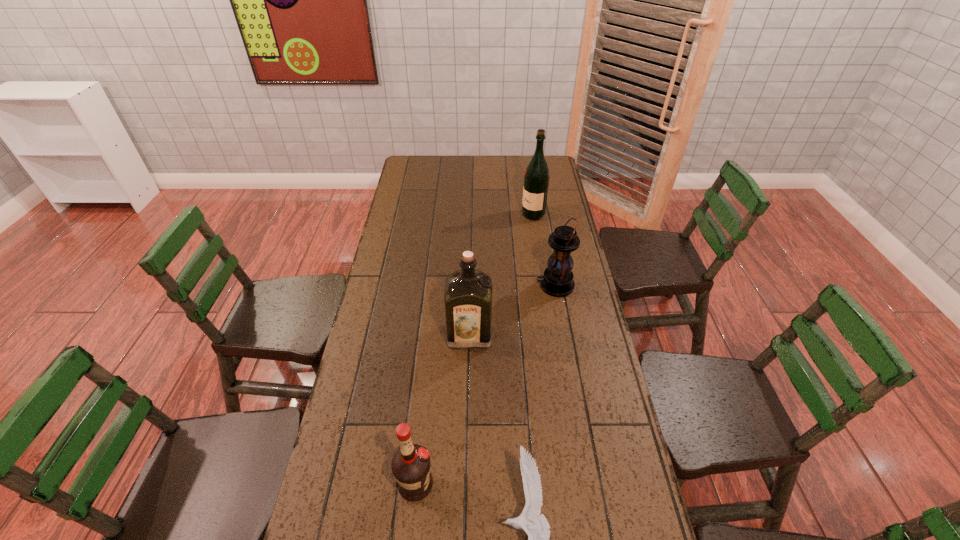
This screenshot has height=540, width=960. I want to click on free point at the far left corner, so click(412, 167).

What are the coordinates of `free space between the fourth object from right to left and the shortest liquor` in the screenshot? It's located at (443, 410).

Identify the location of vacant area between the nearest liquor and the second farthest object. Image resolution: width=960 pixels, height=540 pixels. (486, 385).

Identify the location of free point between the lantern and the shortest liquor. (486, 385).

This screenshot has width=960, height=540. Identify the location of unoccupied area between the lantern and the farthest object. (544, 250).

I want to click on free space between the second liquor from left to right and the rightmost liquor, so click(501, 275).

Identify the location of free spot between the second liquor from right to left and the second farthest object. The height and width of the screenshot is (540, 960). (513, 310).

This screenshot has width=960, height=540. In order to click on the third closest object to the farthest object in this screenshot , I will do `click(535, 524)`.

Where is `object that is the nearest to the fourth nearest object`? object that is the nearest to the fourth nearest object is located at coordinates (468, 292).

The height and width of the screenshot is (540, 960). I want to click on liquor that is the closest to the fourth nearest object, so click(x=468, y=292).